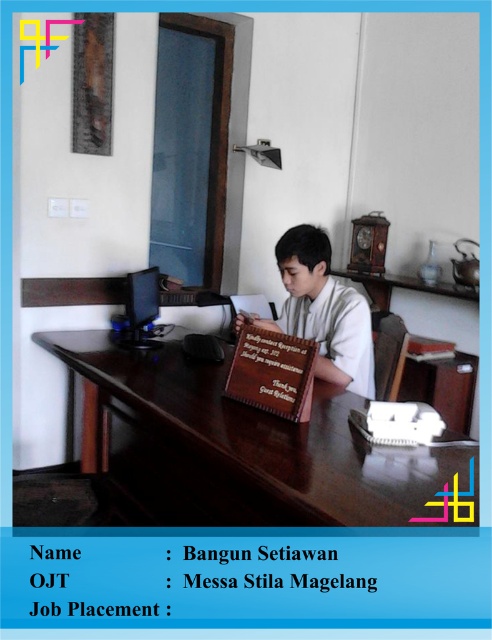
Question: Is brown wooden table at center bigger than wooden plaque at center?

Choices:
 (A) yes
 (B) no

Answer: (A)

Question: Is brown wooden table at center wider than wooden plaque at center?

Choices:
 (A) yes
 (B) no

Answer: (A)

Question: Which point is closer to the camera taking this photo?

Choices:
 (A) (66, 339)
 (B) (321, 348)
 (C) (135, 276)
 (D) (279, 557)

Answer: (D)

Question: Where is brown wooden table at center located in relation to black paper at center in the image?

Choices:
 (A) left
 (B) right

Answer: (A)

Question: Which of the following is the closest to the observer?

Choices:
 (A) brown wooden table at center
 (B) matte black monitor at center
 (C) wooden plaque at center
 (D) black paper at center

Answer: (A)

Question: Which object appears farthest from the camera in this image?

Choices:
 (A) wooden plaque at center
 (B) matte black monitor at center

Answer: (B)